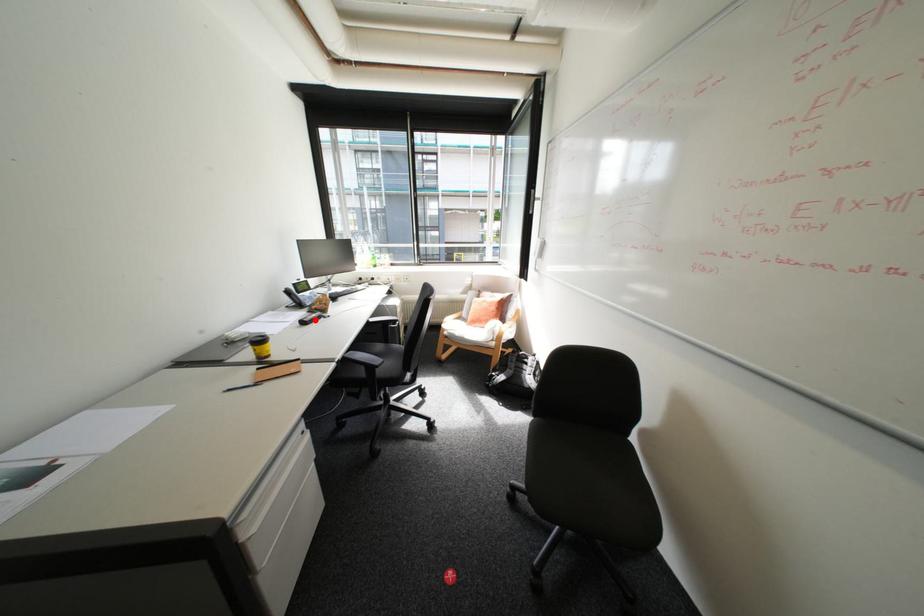
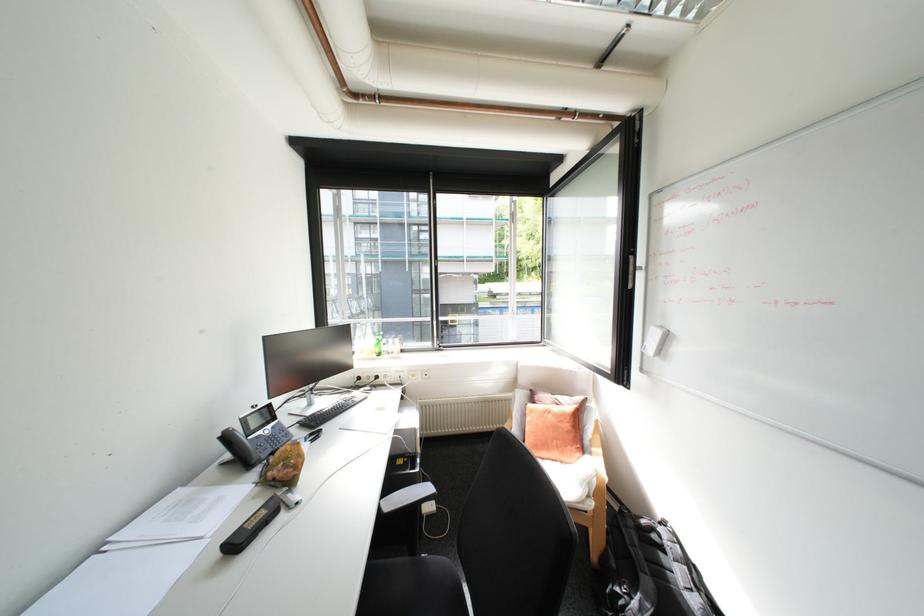
Find the pixel in the second image that matches the highlighted location in the first image.

(248, 539)